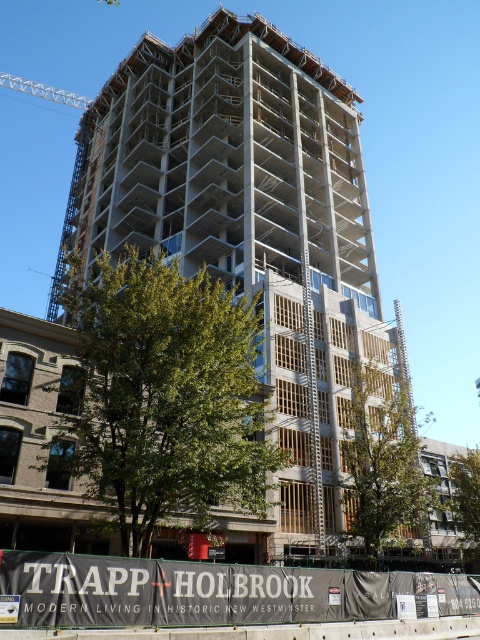
Question: Is white concrete building at center wider than gray concrete construction site at center?

Choices:
 (A) no
 (B) yes

Answer: (B)

Question: Based on their relative distances, which object is farther from the gray concrete construction site at center?

Choices:
 (A) white concrete building at center
 (B) white metallic crane at upper left

Answer: (B)

Question: Is white concrete building at center smaller than gray concrete construction site at center?

Choices:
 (A) yes
 (B) no

Answer: (B)

Question: Is gray concrete construction site at center thinner than white metallic crane at upper left?

Choices:
 (A) no
 (B) yes

Answer: (B)

Question: Which point appears farthest from the camera in this image?

Choices:
 (A) (256, 620)
 (B) (75, 186)

Answer: (B)

Question: Which object is positioned farthest from the white metallic crane at upper left?

Choices:
 (A) gray concrete construction site at center
 (B) white concrete building at center

Answer: (A)